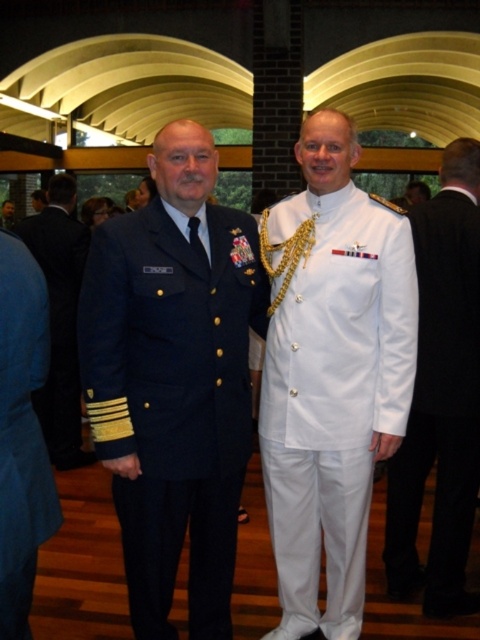
Does white glossy uniform at center appear on the left side of blue fabric jacket at left?

No, white glossy uniform at center is not to the left of blue fabric jacket at left.

Between white glossy uniform at center and blue fabric jacket at left, which one appears on the right side from the viewer's perspective?

Positioned to the right is white glossy uniform at center.

Where is `white glossy uniform at center`? white glossy uniform at center is located at coordinates (331, 390).

You are a GUI agent. You are given a task and a screenshot of the screen. Output one action in this format:
    pyautogui.click(x=<x>, y=<y>)
    Task: Click on the white glossy uniform at center
    
    Given the screenshot: What is the action you would take?
    pyautogui.click(x=331, y=390)

Is navy blue fabric uniform at left above blue fabric jacket at left?

Actually, navy blue fabric uniform at left is below blue fabric jacket at left.

Is navy blue fabric uniform at left positioned at the back of blue fabric jacket at left?

That is True.

Which is in front, point (230, 525) or point (21, 592)?

Point (21, 592) is in front.

At what (x,y) coordinates should I click in order to perform the action: click on navy blue fabric uniform at left. Please return your answer as a coordinate pair (x, y). Looking at the image, I should click on (172, 400).

Does navy blue fabric uniform at left appear under white glossy uniform at right?

Yes.

Does point (149, 529) lie behind point (472, 291)?

No, it is not.

Where is `navy blue fabric uniform at left`? navy blue fabric uniform at left is located at coordinates (172, 400).